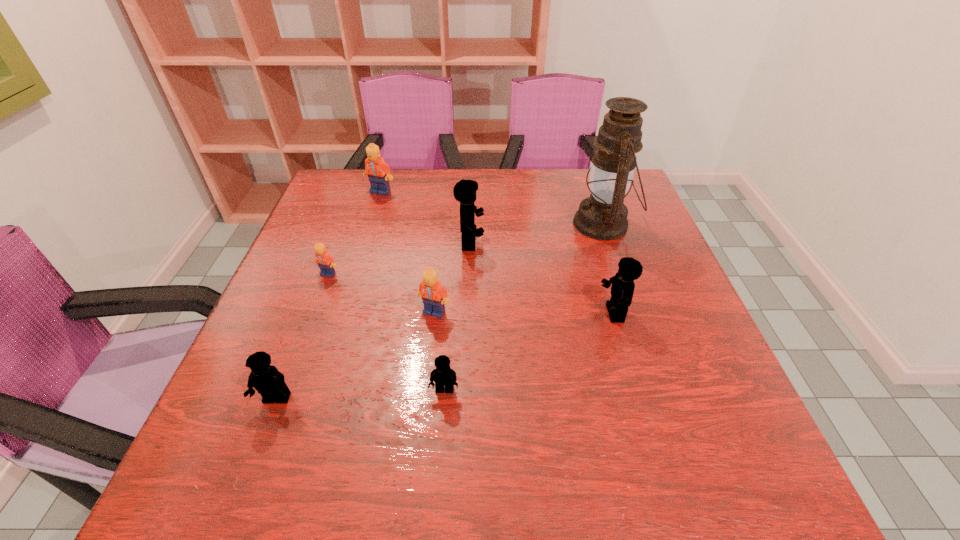
Locate an element on the screen. The image size is (960, 540). orange Lego that is the closest to the smallest yellow Lego is located at coordinates (434, 295).

Where is `free space that satisfies the following two spatial constraints: 1. on the front-facing side of the biggest yellow Lego; 2. on the front-facing side of the smallest orange Lego`? free space that satisfies the following two spatial constraints: 1. on the front-facing side of the biggest yellow Lego; 2. on the front-facing side of the smallest orange Lego is located at coordinates (469, 274).

Identify the location of free space that satisfies the following two spatial constraints: 1. on the front-facing side of the tallest Lego; 2. on the front-facing side of the smallest yellow Lego. (466, 390).

Where is `blank space that satisfies the following two spatial constraints: 1. on the front side of the tallest object; 2. on the front-facing side of the second tallest object`? The image size is (960, 540). blank space that satisfies the following two spatial constraints: 1. on the front side of the tallest object; 2. on the front-facing side of the second tallest object is located at coordinates (610, 243).

Image resolution: width=960 pixels, height=540 pixels. Find the location of `vacant position in the image that satisfies the following two spatial constraints: 1. on the front-facing side of the sixth nearest Lego; 2. on the front-facing side of the rightmost orange Lego`. vacant position in the image that satisfies the following two spatial constraints: 1. on the front-facing side of the sixth nearest Lego; 2. on the front-facing side of the rightmost orange Lego is located at coordinates (468, 312).

Where is `free space that satisfies the following two spatial constraints: 1. on the front-facing side of the seventh shortest object; 2. on the front-facing side of the leftmost yellow Lego`? free space that satisfies the following two spatial constraints: 1. on the front-facing side of the seventh shortest object; 2. on the front-facing side of the leftmost yellow Lego is located at coordinates (466, 399).